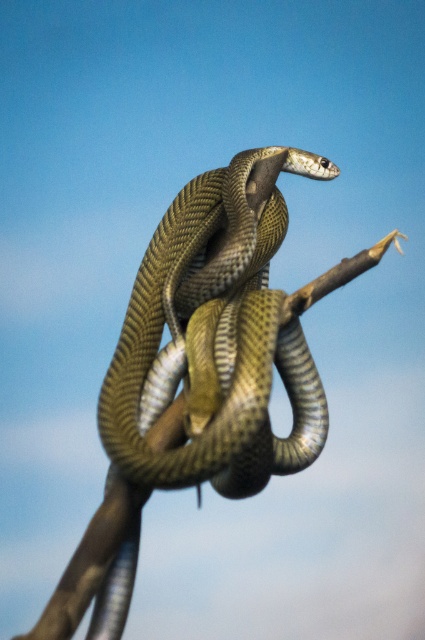
You are a wildlife photographer aiming to capture the shiny green snake at center and the brown wood at center in a single frame. Based on their sizes, which object should you focus on first to ensure both are in focus?

The shiny green snake at center is bigger than brown wood at center, so you should focus on the shiny green snake at center first to ensure both are in focus since it occupies more space in the frame.

You are an ornithologist observing a snake coiled around a branch in a clear blue sky. You notice a point at coordinate (215, 337). What is located at that point?

At point (215, 337) lies a shiny green snake at center.